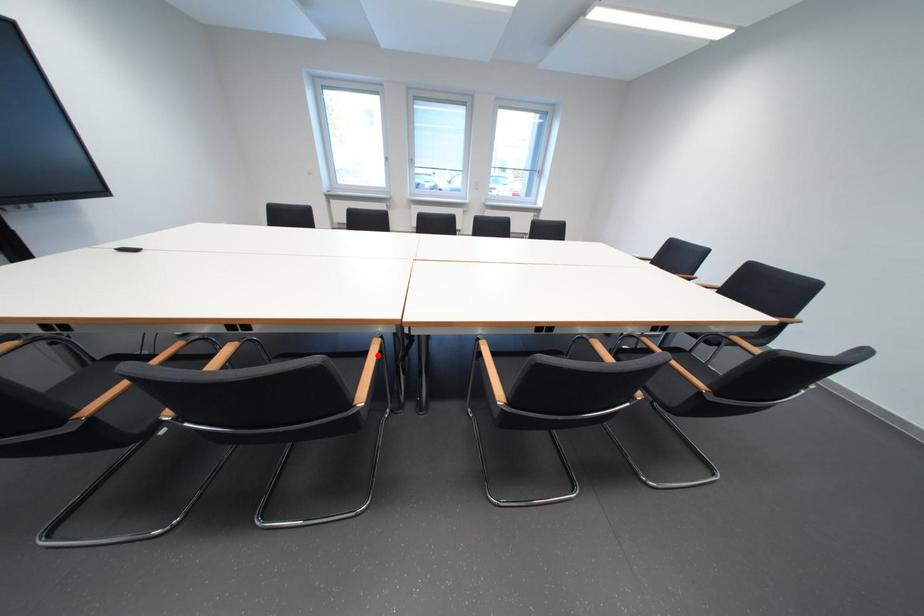
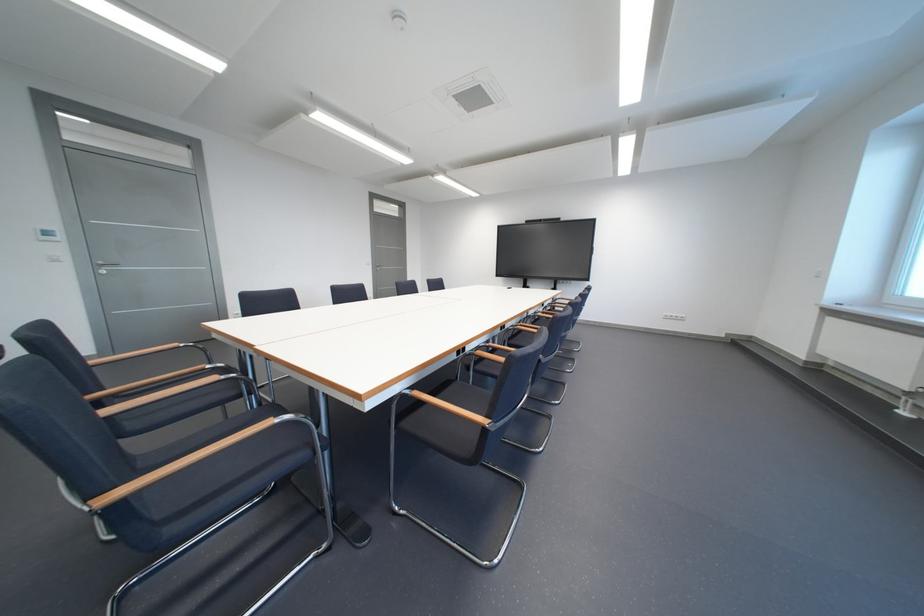
Question: I am providing you with two images of the same scene from different viewpoints. A red point is marked on the first image. Is the red point's position out of view in image 2?

Choices:
 (A) Yes
 (B) No

Answer: (A)